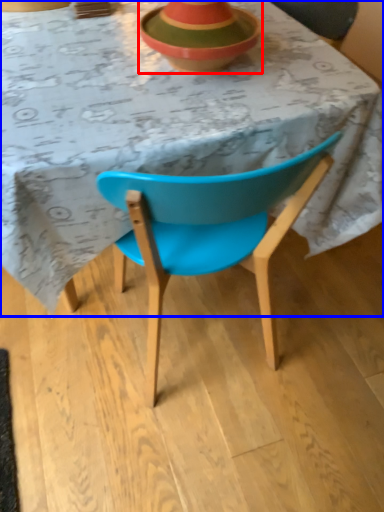
Question: Among these objects, which one is nearest to the camera, bowl (highlighted by a red box) or table (highlighted by a blue box)?

Choices:
 (A) bowl
 (B) table

Answer: (B)